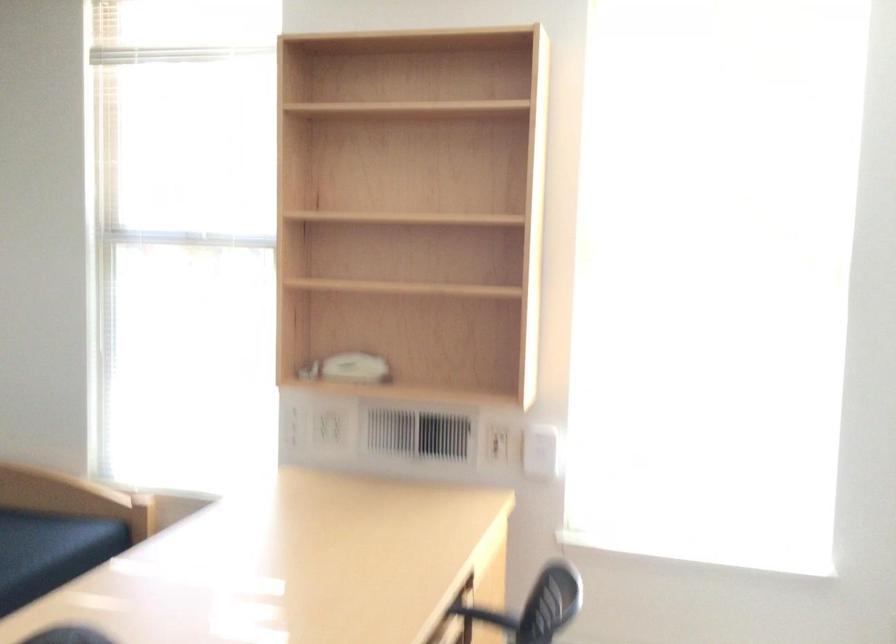
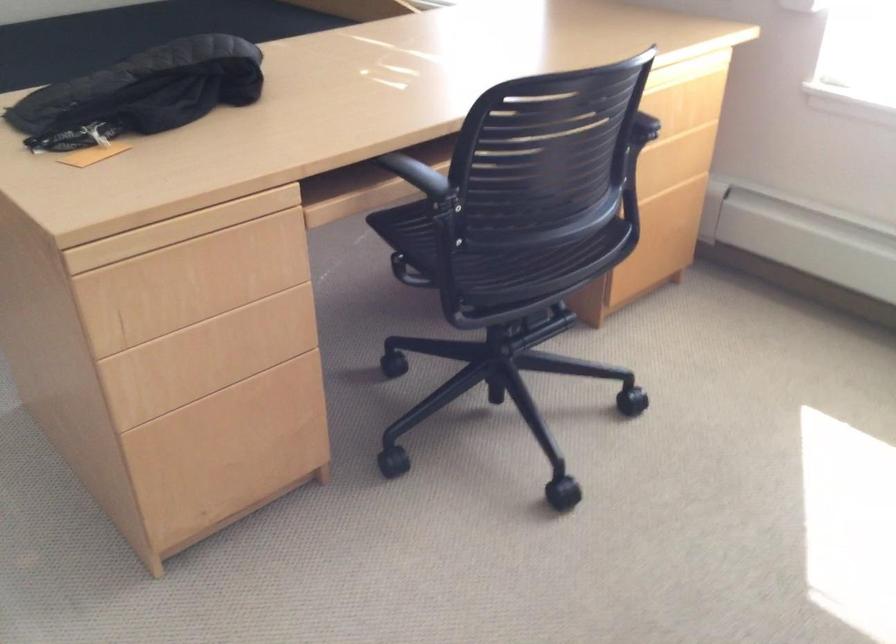
First-person continuous shooting, in which direction is the camera rotating?

The rotation direction of the camera is left-down.